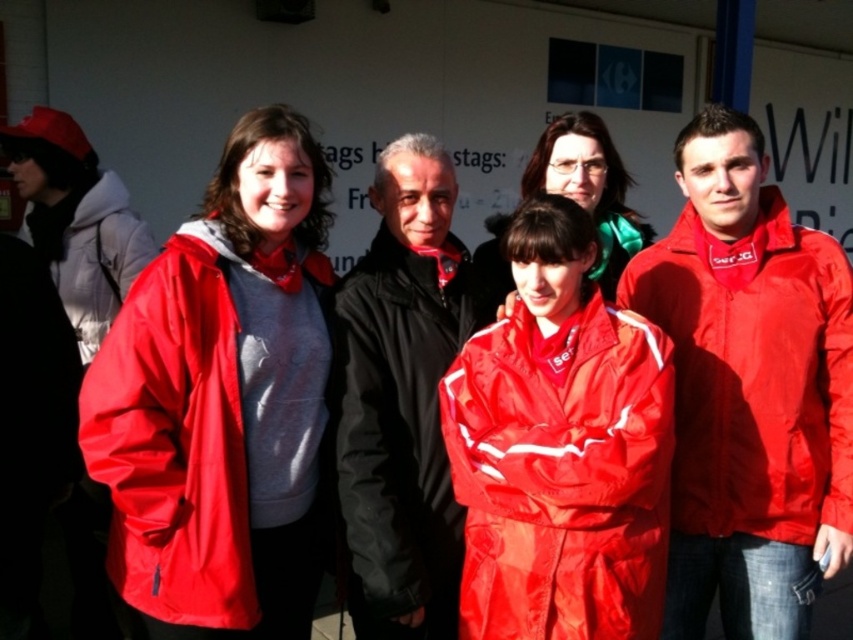
You are standing in front of the building and need to pass between the black matte jacket at center and the matte red jacket at left to reach the entrance. Your backpack is 4 feet wide. Can you fit through the space between them?

The black matte jacket at center is 4.40 feet away from the matte red jacket at left, so yes, the backpack can fit through the space between them since it is wider than the backpack.

You are organizing a photo shoot and need to ensure that all jackets in the image are visible. Given that the matte red jacket at right and the black matte jacket at center are part of the group, which jacket might require more space in the frame to accommodate its size?

The matte red jacket at right requires more space in the frame because its width is larger than the black matte jacket at center.